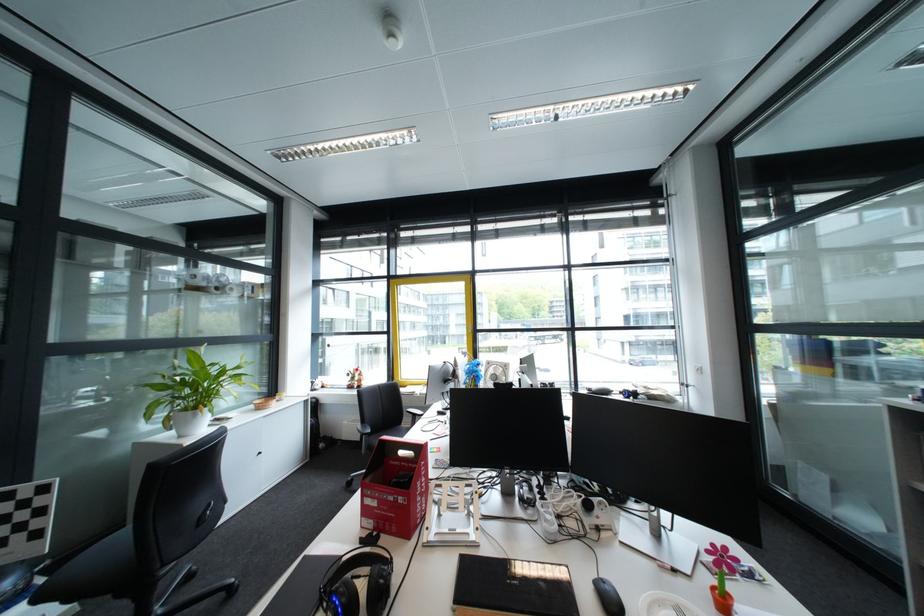
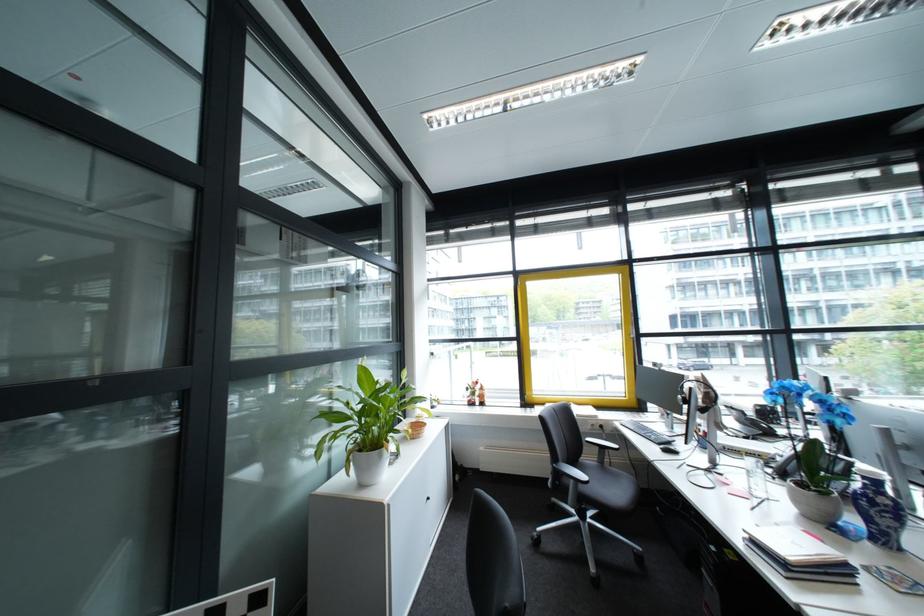
The images are taken continuously from a first-person perspective. In which direction are you moving?

The cameraman walked toward left, forward.